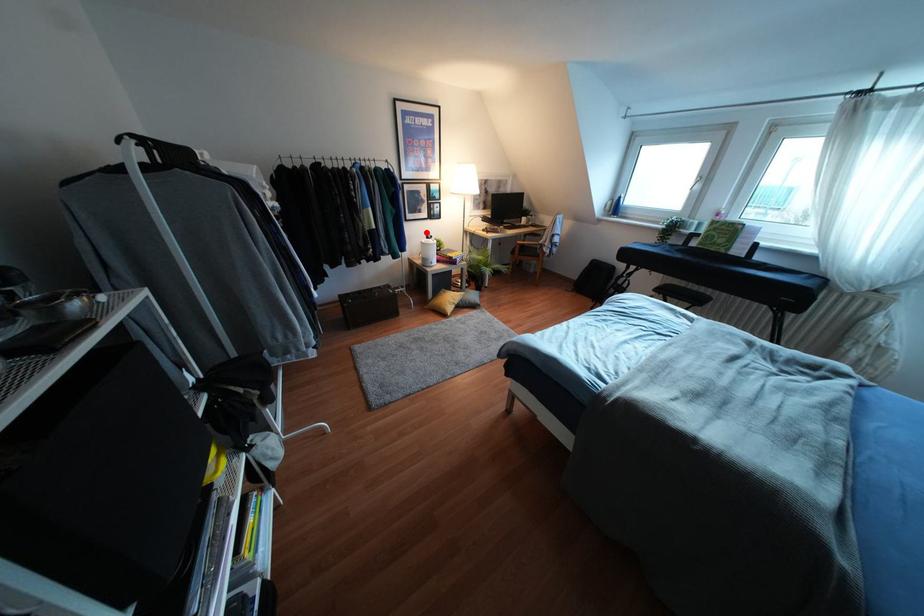
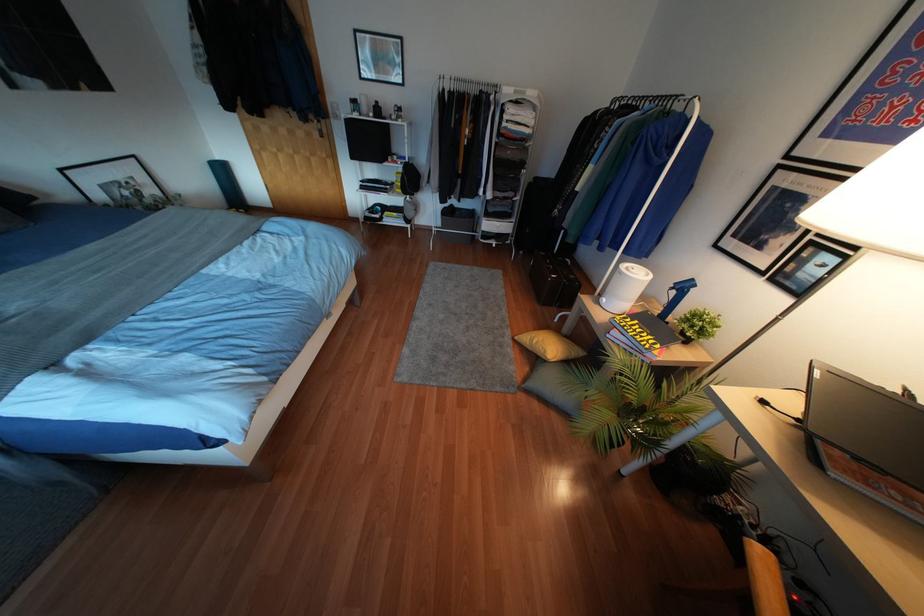
Question: A red point is marked in image1. In image2, is the corresponding 3D point closer to the camera or farther? Reply with the corresponding letter.

Choices:
 (A) The corresponding 3D point is closer.
 (B) The corresponding 3D point is farther.

Answer: (B)